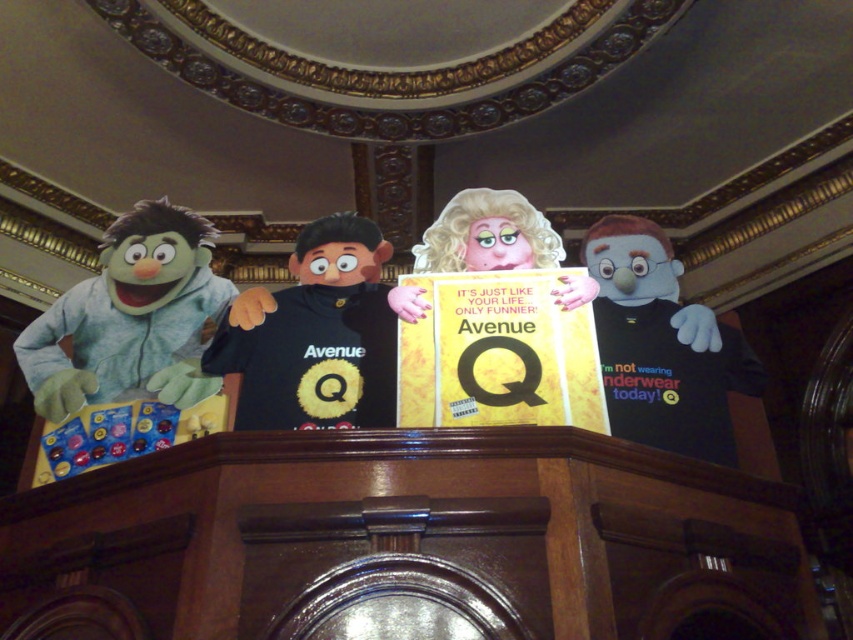
You are a photographer standing in front of the four puppet characters. You notice two points marked in the image at coordinates point [70,381] and point [251,356]. Which point is closer to your camera?

Point [70,381] is closer to the camera than point [251,356] because it is further to the camera than the other point.

You are standing 2 meters away from the podium. Can you reach the point at coordinates point (167, 362) without moving closer?

The point at coordinates point (167, 362) is 2.06 meters away from the viewer. Since you are standing 2 meters away from the podium, you are slightly closer than the point, so you can reach it without moving closer.